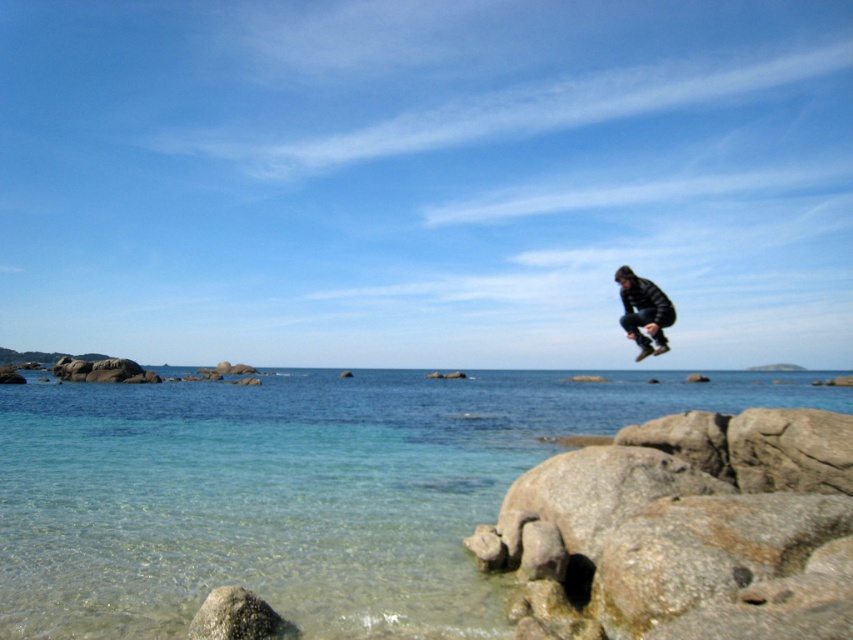
Does clear water at lower left have a greater height compared to dark blue jacket at center?

Correct, clear water at lower left is much taller as dark blue jacket at center.

Is point (21, 547) farther from camera compared to point (641, 353)?

Yes, point (21, 547) is farther from viewer.

You are a GUI agent. You are given a task and a screenshot of the screen. Output one action in this format:
    pyautogui.click(x=<x>, y=<y>)
    Task: Click on the clear water at lower left
    The width and height of the screenshot is (853, 640).
    Given the screenshot: What is the action you would take?
    (x=297, y=490)

Looking at this image, is clear water at lower left taller than gray rock at lower left?

Yes.

Can you confirm if clear water at lower left is positioned below gray rock at lower left?

Yes.

Who is more distant from viewer, (9,424) or (206,634)?

The point (9,424) is more distant.

At what (x,y) coordinates should I click in order to perform the action: click on clear water at lower left. Please return your answer as a coordinate pair (x, y). Looking at the image, I should click on (297, 490).

Does gray rock at lower left have a greater width compared to dark blue jacket at center?

No.

Does point (291, 625) come behind point (634, 284)?

No, it is in front of (634, 284).

Image resolution: width=853 pixels, height=640 pixels. In order to click on gray rock at lower left in this screenshot , I will do `click(236, 618)`.